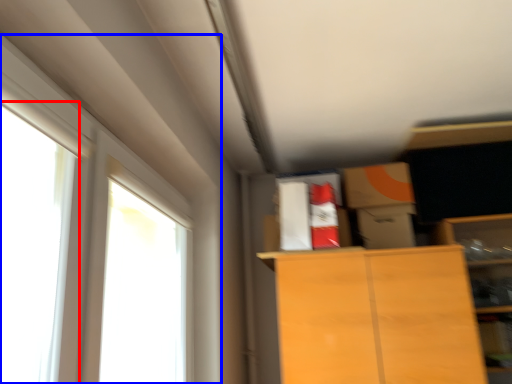
Question: Which object is closer to the camera taking this photo, window (highlighted by a red box) or window (highlighted by a blue box)?

Choices:
 (A) window
 (B) window

Answer: (A)